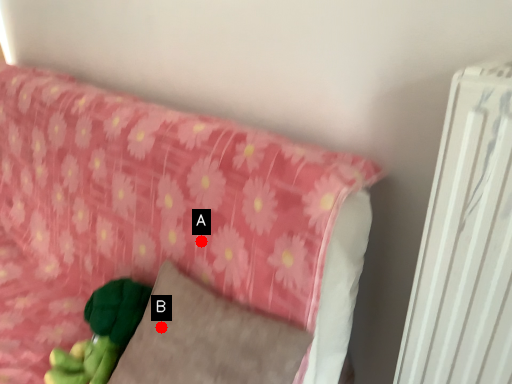
Question: Two points are circled on the image, labeled by A and B beside each circle. Which of the following is the closest to the observer?

Choices:
 (A) A is closer
 (B) B is closer

Answer: (B)